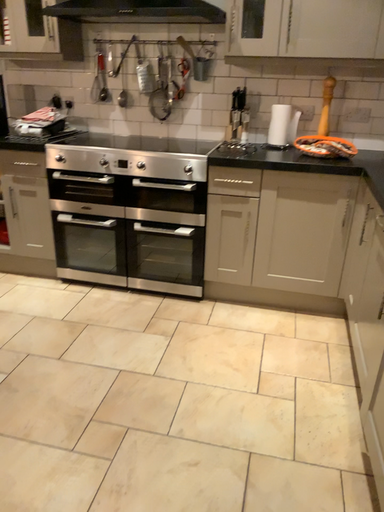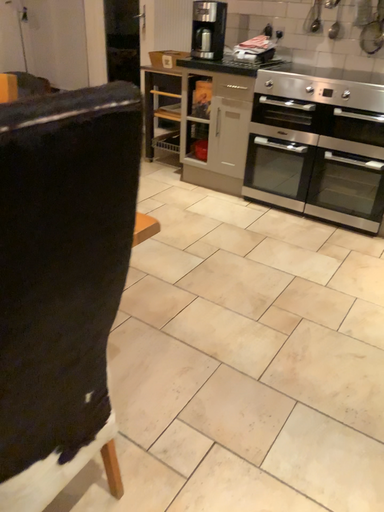
Question: How did the camera likely rotate when shooting the video?

Choices:
 (A) rotated left
 (B) rotated right

Answer: (A)